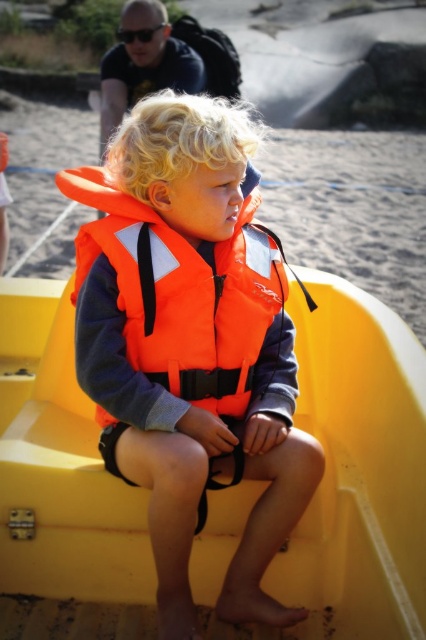
The child is sitting in the boat and needs to put on either the orange fabric life vest at center or the orange fabric life jacket at center. Which one is closer to the child?

The orange fabric life vest at center and orange fabric life jacket at center are 1.92 inches apart, so the one closer to the child would be the one that is 1.92 inches away. However, since both are at the same center position, they might be the same item. Please check again.